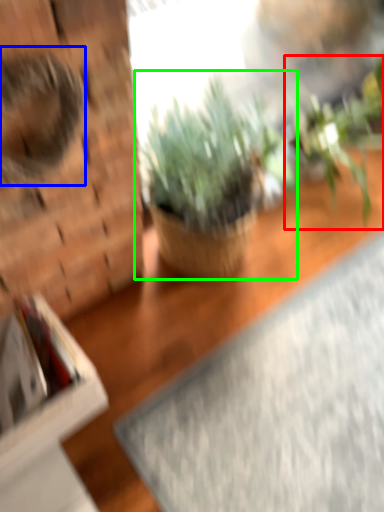
Question: Estimate the real-world distances between objects in this image. Which object is farther from houseplant (highlighted by a red box), animal (highlighted by a blue box) or houseplant (highlighted by a green box)?

Choices:
 (A) animal
 (B) houseplant

Answer: (A)